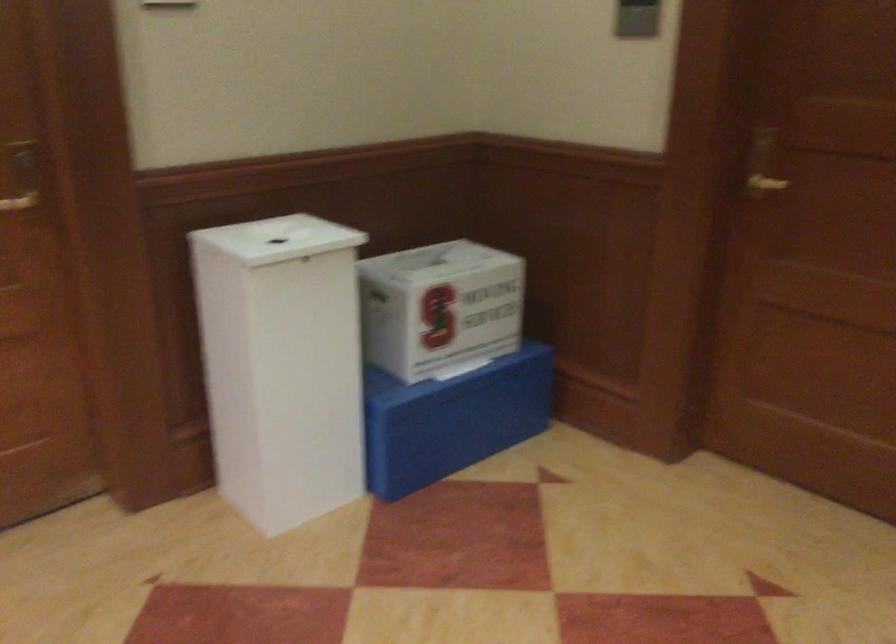
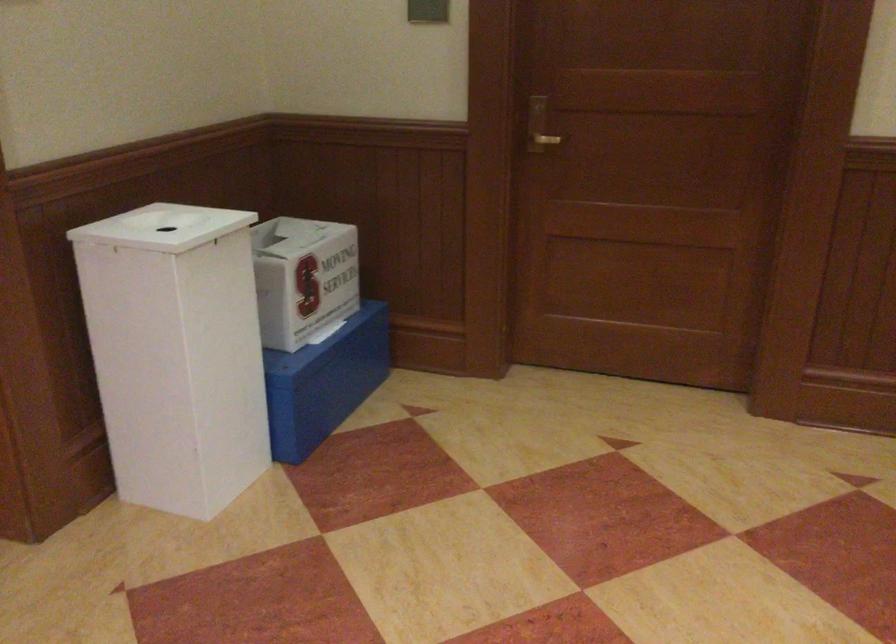
Where in the second image is the point corresponding to (286,239) from the first image?

(164, 227)